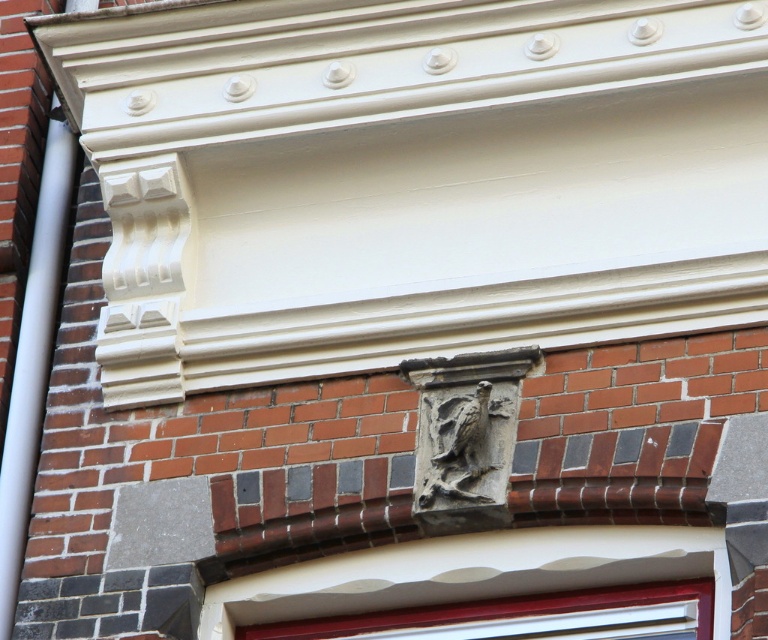
Question: Can you confirm if white painted wood at lower center is positioned to the left of gray stone eagle at center?

Choices:
 (A) yes
 (B) no

Answer: (B)

Question: Is white painted wood at lower center positioned in front of gray stone eagle at center?

Choices:
 (A) yes
 (B) no

Answer: (A)

Question: Among these objects, which one is nearest to the camera?

Choices:
 (A) white painted wood at lower center
 (B) gray stone eagle at center

Answer: (A)

Question: Is white painted wood at lower center positioned at the back of gray stone eagle at center?

Choices:
 (A) yes
 (B) no

Answer: (B)

Question: Which point is closer to the camera taking this photo?

Choices:
 (A) (445, 502)
 (B) (525, 595)

Answer: (A)

Question: Which of the following is the closest to the observer?

Choices:
 (A) (439, 429)
 (B) (697, 595)

Answer: (B)